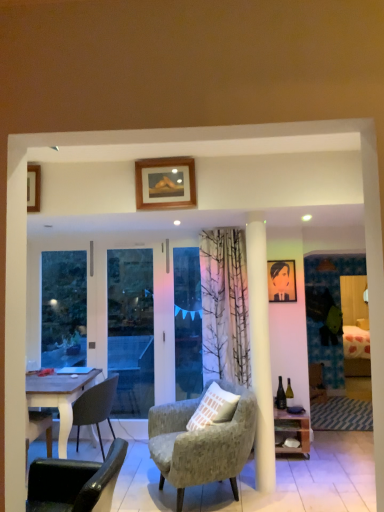
The image size is (384, 512). Describe the element at coordinates (165, 183) in the screenshot. I see `wooden picture frame at upper center, which is the second picture frame in bottom-to-top order` at that location.

What is the approximate width of matte black portrait at upper right, marked as the 2th picture frame in a top-to-bottom arrangement?

The width of matte black portrait at upper right, marked as the 2th picture frame in a top-to-bottom arrangement, is 1.01 inches.

Measure the distance between point (80, 415) and camera.

The depth of point (80, 415) is 13.24 feet.

Describe the element at coordinates (95, 408) in the screenshot. The width and height of the screenshot is (384, 512). I see `dark gray fabric chair at lower left, acting as the 3th chair starting from the right` at that location.

Locate an element on the screen. The width and height of the screenshot is (384, 512). transparent glass door at center is located at coordinates (187, 322).

This screenshot has height=512, width=384. I want to click on textured gray armchair at center, arranged as the second chair when viewed from the front, so click(201, 443).

Identify the location of green glass bottle at center-right. (289, 393).

Describe the element at coordinates (292, 432) in the screenshot. This screenshot has width=384, height=512. I see `wooden shelf at lower right` at that location.

I want to click on wooden picture frame at upper center, which is the first picture frame from front to back, so click(x=165, y=183).

What are the coordinates of `screen door that appears above the wooden shelf at lower right (from a real-world perspective)` in the screenshot? It's located at (150, 325).

Could you tell me if wooden shelf at lower right is turned towards transparent glass screen door at left?

No, wooden shelf at lower right is not facing towards transparent glass screen door at left.

Considering the positions of points (293, 423) and (176, 295), is point (293, 423) farther from camera compared to point (176, 295)?

No, it is in front of (176, 295).

From the image's perspective, does wooden shelf at lower right appear lower than transparent glass screen door at left?

Yes, from the image's perspective, wooden shelf at lower right is below transparent glass screen door at left.

Is textured gray armchair at center, which appears as the 2th chair when viewed from the back, taller or shorter than matte black portrait at upper right, arranged as the 1th picture frame when viewed from the right?

Clearly, textured gray armchair at center, which appears as the 2th chair when viewed from the back, is taller compared to matte black portrait at upper right, arranged as the 1th picture frame when viewed from the right.

Locate an element on the screen. chair that is the 1st one when counting leftward from the matte black portrait at upper right, marked as the 2th picture frame in a top-to-bottom arrangement is located at coordinates (201, 443).

From a real-world perspective, is textured gray armchair at center, arranged as the second chair when viewed from the front, physically located above or below matte black portrait at upper right, positioned as the first picture frame in back-to-front order?

Clearly, from a real-world perspective, textured gray armchair at center, arranged as the second chair when viewed from the front, is below matte black portrait at upper right, positioned as the first picture frame in back-to-front order.

Is textured gray armchair at center, which is the 3th chair from left to right, inside or outside of matte black portrait at upper right, marked as the 2th picture frame in a top-to-bottom arrangement?

textured gray armchair at center, which is the 3th chair from left to right, is not enclosed by matte black portrait at upper right, marked as the 2th picture frame in a top-to-bottom arrangement.

Is matte black portrait at upper right, arranged as the 1th picture frame when ordered from the bottom, completely or partially outside of textured gray armchair at center, which appears as the 2th chair when viewed from the back?

Yes, matte black portrait at upper right, arranged as the 1th picture frame when ordered from the bottom, is located beyond the bounds of textured gray armchair at center, which appears as the 2th chair when viewed from the back.

This screenshot has width=384, height=512. I want to click on the 2nd chair in front of the matte black portrait at upper right, positioned as the first picture frame in back-to-front order, so (x=201, y=443).

Who is bigger, matte black portrait at upper right, positioned as the first picture frame in back-to-front order, or textured gray armchair at center, which is the 3th chair from left to right?

textured gray armchair at center, which is the 3th chair from left to right, is bigger.

Does point (146, 279) come closer to viewer compared to point (284, 418)?

No.

Would you say transparent glass screen door at left is a long distance from wooden shelf at lower right?

Indeed, transparent glass screen door at left is not near wooden shelf at lower right.

Who is more distant, transparent glass screen door at left or wooden shelf at lower right?

Positioned behind is transparent glass screen door at left.

In the image, there is a wooden shelf at lower right. Identify the location of screen door above it (from the image's perspective). (150, 325).

What's the angular difference between dark gray fabric chair at lower left, the 3th chair from the front, and wooden picture frame at upper center, which ranks as the second picture frame in right-to-left order,'s facing directions?

dark gray fabric chair at lower left, the 3th chair from the front, and wooden picture frame at upper center, which ranks as the second picture frame in right-to-left order, are facing 90 degrees away from each other.

Consider the image. Can you confirm if dark gray fabric chair at lower left, which appears as the 1th chair when viewed from the left, is shorter than wooden picture frame at upper center, which is the first picture frame from front to back?

No.

From a real-world perspective, does dark gray fabric chair at lower left, which ranks as the 1th chair in back-to-front order, stand above wooden picture frame at upper center, which is the second picture frame in bottom-to-top order?

No.

Which is more to the left, wooden picture frame at upper center, marked as the second picture frame in a back-to-front arrangement, or black leather chair at lower left, which is the first chair in front-to-back order?

Positioned to the left is black leather chair at lower left, which is the first chair in front-to-back order.

In terms of width, does wooden picture frame at upper center, which is the 1th picture frame from left to right, look wider or thinner when compared to black leather chair at lower left, the second chair in the left-to-right sequence?

In the image, wooden picture frame at upper center, which is the 1th picture frame from left to right, appears to be more narrow than black leather chair at lower left, the second chair in the left-to-right sequence.

Can you confirm if wooden picture frame at upper center, the 1th picture frame viewed from the top, is taller than black leather chair at lower left, the second chair positioned from the right?

Indeed, wooden picture frame at upper center, the 1th picture frame viewed from the top, has a greater height compared to black leather chair at lower left, the second chair positioned from the right.

The height and width of the screenshot is (512, 384). I want to click on the 1st picture frame behind when counting from the black leather chair at lower left, the second chair in the left-to-right sequence, so click(165, 183).

From the image's perspective, would you say black leather chair at lower left, the second chair positioned from the right, is positioned over wooden shelf at lower right?

Yes, from the image's perspective, black leather chair at lower left, the second chair positioned from the right, is on top of wooden shelf at lower right.

I want to click on the 3rd chair above the wooden shelf at lower right (from a real-world perspective), so click(x=74, y=482).

Between black leather chair at lower left, which is the first chair in front-to-back order, and wooden shelf at lower right, which one has larger size?

Bigger between the two is black leather chair at lower left, which is the first chair in front-to-back order.

Does black leather chair at lower left, which is the first chair in front-to-back order, have a greater height compared to wooden shelf at lower right?

In fact, black leather chair at lower left, which is the first chair in front-to-back order, may be shorter than wooden shelf at lower right.

The height and width of the screenshot is (512, 384). I want to click on shelf below the transparent glass screen door at left (from the image's perspective), so click(x=292, y=432).

Where is `picture frame on the right of textured gray armchair at center, which appears as the 2th chair when viewed from the back`? picture frame on the right of textured gray armchair at center, which appears as the 2th chair when viewed from the back is located at coordinates (281, 281).

When comparing their distances from textured gray armchair at center, which is the 3th chair from left to right, does dark gray fabric chair at lower left, the 3th chair from the front, or matte black portrait at upper right, positioned as the first picture frame in back-to-front order, seem closer?

Based on the image, dark gray fabric chair at lower left, the 3th chair from the front, appears to be nearer to textured gray armchair at center, which is the 3th chair from left to right.

Looking at the image, which one is located closer to wooden shelf at lower right, wooden picture frame at upper center, which is the first picture frame from front to back, or matte black portrait at upper right, arranged as the 1th picture frame when ordered from the bottom?

matte black portrait at upper right, arranged as the 1th picture frame when ordered from the bottom, is positioned closer to the anchor wooden shelf at lower right.

Considering their positions, is wooden shelf at lower right positioned closer to dark gray fabric chair at lower left, which ranks as the 1th chair in back-to-front order, than matte black portrait at upper right, arranged as the 1th picture frame when ordered from the bottom?

Among the two, wooden shelf at lower right is located nearer to dark gray fabric chair at lower left, which ranks as the 1th chair in back-to-front order.

Based on their spatial positions, is black leather chair at lower left, the second chair in the left-to-right sequence, or textured gray armchair at center, arranged as the second chair when viewed from the front, further from wooden picture frame at upper center, which is the first picture frame from front to back?

black leather chair at lower left, the second chair in the left-to-right sequence, is positioned further to the anchor wooden picture frame at upper center, which is the first picture frame from front to back.

From the image, which object appears to be farther from transparent glass door at center, green glass bottle at center-right or textured gray armchair at center, which is the 3th chair from left to right?

green glass bottle at center-right is positioned further to the anchor transparent glass door at center.

Estimate the real-world distances between objects in this image. Which object is closer to wooden picture frame at upper center, which is the first picture frame from front to back, green glass bottle at center-right or wooden shelf at lower right?

wooden shelf at lower right is positioned closer to the anchor wooden picture frame at upper center, which is the first picture frame from front to back.

Which object lies nearer to the anchor point wooden shelf at lower right, transparent glass door at center or dark gray fabric chair at lower left, which appears as the 1th chair when viewed from the left?

The object closer to wooden shelf at lower right is transparent glass door at center.

Looking at the image, which one is located closer to dark gray fabric chair at lower left, the 3th chair from the front, wooden shelf at lower right or transparent glass screen door at left?

Among the two, transparent glass screen door at left is located nearer to dark gray fabric chair at lower left, the 3th chair from the front.

You are a GUI agent. You are given a task and a screenshot of the screen. Output one action in this format:
    pyautogui.click(x=<x>, y=<y>)
    Task: Click on the glass door between transparent glass screen door at left and matte black portrait at upper right, positioned as the first picture frame in back-to-front order, from left to right
    The width and height of the screenshot is (384, 512).
    Given the screenshot: What is the action you would take?
    pyautogui.click(x=187, y=322)

Locate an element on the screen. The width and height of the screenshot is (384, 512). shelf between black leather chair at lower left, the second chair in the left-to-right sequence, and transparent glass door at center in the front-back direction is located at coordinates (292, 432).

I want to click on shelf located between black leather chair at lower left, which is the first chair in front-to-back order, and transparent glass screen door at left in the depth direction, so click(x=292, y=432).

What are the coordinates of `glass door between matte black portrait at upper right, marked as the 2th picture frame in a top-to-bottom arrangement, and wooden shelf at lower right from top to bottom` in the screenshot? It's located at (187, 322).